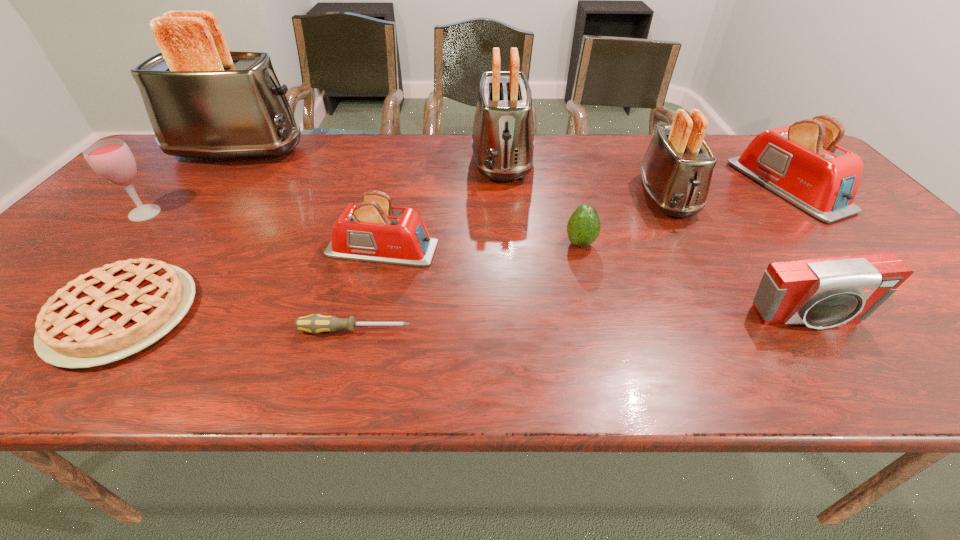
Where is `the tallest object`? The image size is (960, 540). the tallest object is located at coordinates (202, 100).

At what (x,y) coordinates should I click in order to perform the action: click on the tallest toaster. Please return your answer as a coordinate pair (x, y). The image size is (960, 540). Looking at the image, I should click on (202, 100).

Locate an element on the screen. the ninth shortest object is located at coordinates (503, 143).

I want to click on the third toaster from left to right, so click(503, 143).

In order to click on the smallest gray toaster in this screenshot , I will do `click(677, 168)`.

Find the location of `the second toaster from right to left`. the second toaster from right to left is located at coordinates (677, 168).

Where is `the second shortest toaster`? This screenshot has width=960, height=540. the second shortest toaster is located at coordinates (800, 162).

This screenshot has width=960, height=540. I want to click on the right red toaster, so click(x=800, y=162).

The image size is (960, 540). In order to click on wineglass in this screenshot , I will do `click(111, 159)`.

Locate an element on the screen. the second toaster from left to right is located at coordinates (374, 231).